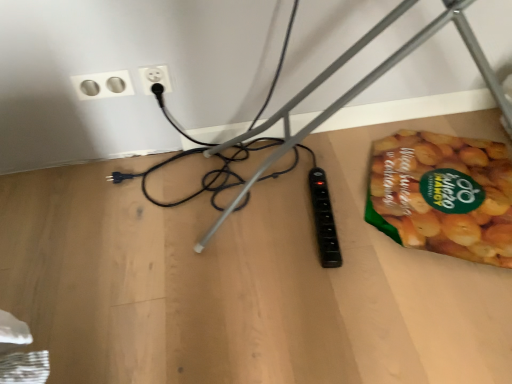
This screenshot has width=512, height=384. Identify the location of vacant area to the left of green matte snack packet at lower right. (304, 220).